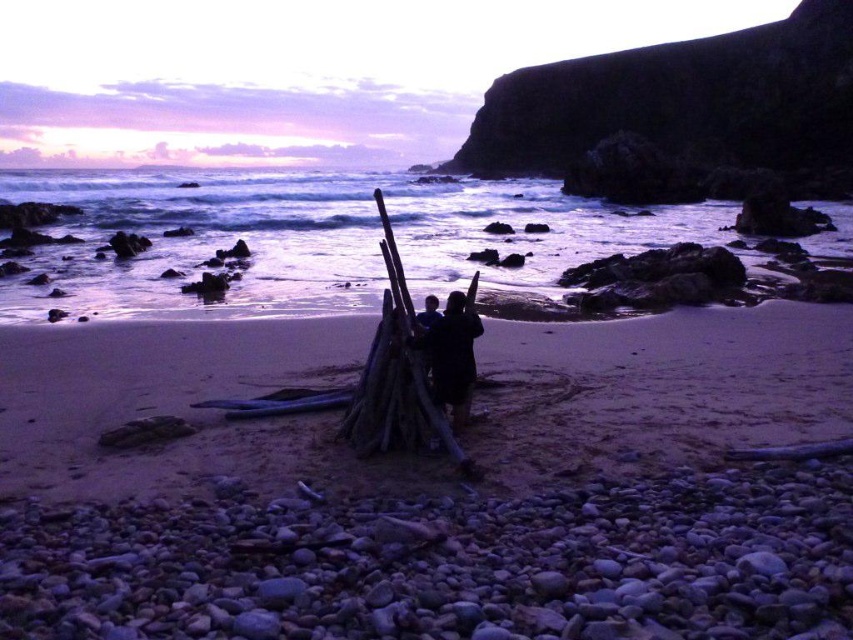
Is smooth sand at center in front of dark clothing at center?

Yes, it is.

Can you confirm if smooth sand at center is taller than dark clothing at center?

Correct, smooth sand at center is much taller as dark clothing at center.

The height and width of the screenshot is (640, 853). What are the coordinates of `smooth sand at center` in the screenshot? It's located at (431, 486).